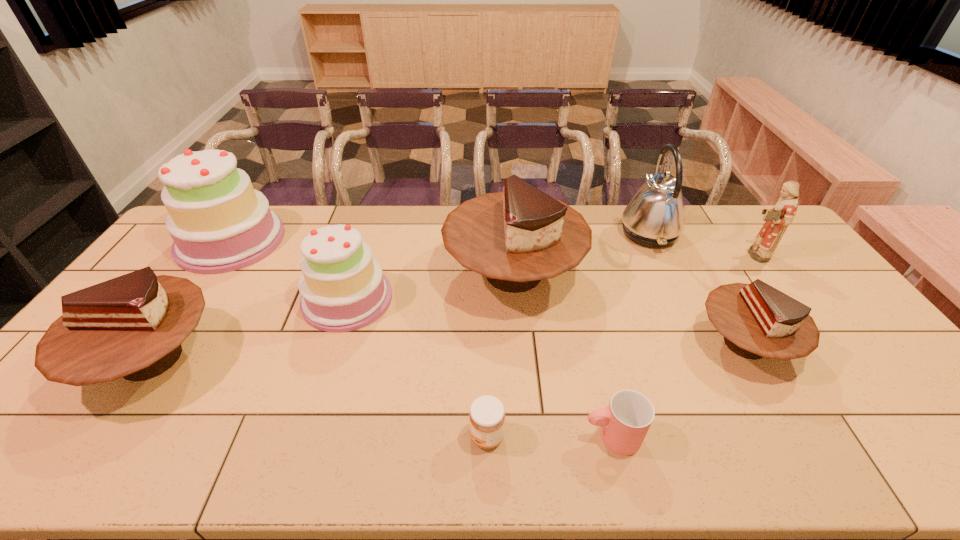
This screenshot has height=540, width=960. What are the coordinates of `the closest red cake to the jam` in the screenshot? It's located at (516, 238).

Find the location of a particular element. red cake that is the closest to the shortest cake is located at coordinates (516, 238).

At what (x,y) coordinates should I click in order to perform the action: click on vacant space that satisfies the following two spatial constraints: 1. on the side of the cup with the handle; 2. on the front side of the biggest red cake. Please return your answer as a coordinate pair (x, y). Looking at the image, I should click on click(573, 273).

Find the location of a particular element. The height and width of the screenshot is (540, 960). vacant area that satisfies the following two spatial constraints: 1. on the front label of the orange jam; 2. on the side of the cup with the handle is located at coordinates (487, 436).

At what (x,y) coordinates should I click in order to perform the action: click on free spot that satisfies the following two spatial constraints: 1. from the spout of the kettle; 2. on the front side of the left purple cake. Please return your answer as a coordinate pair (x, y). Looking at the image, I should click on 652,241.

Image resolution: width=960 pixels, height=540 pixels. I want to click on free spot that satisfies the following two spatial constraints: 1. on the back side of the biggest red cake; 2. on the right side of the right purple cake, so click(355, 273).

Locate an element on the screen. This screenshot has width=960, height=540. vacant area in the image that satisfies the following two spatial constraints: 1. on the side of the cup with the handle; 2. on the front label of the orange jam is located at coordinates (612, 436).

The width and height of the screenshot is (960, 540). Identify the location of free space that satisfies the following two spatial constraints: 1. on the side of the cup with the handle; 2. on the front side of the right purple cake. (579, 299).

This screenshot has height=540, width=960. What are the coordinates of `vacant position in the image that satisfies the following two spatial constraints: 1. on the side of the seventh tallest object with the handle; 2. on the left side of the cup` in the screenshot? It's located at (589, 343).